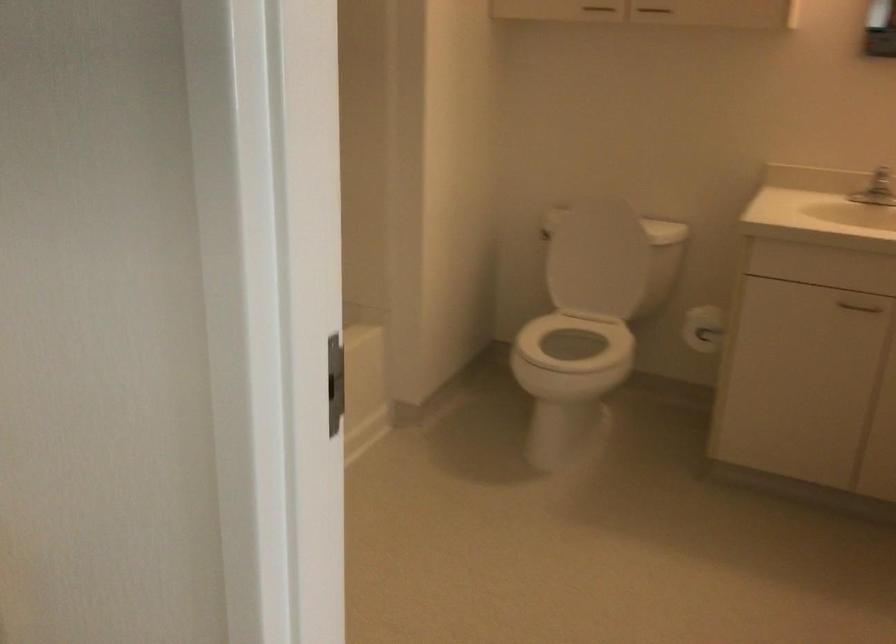
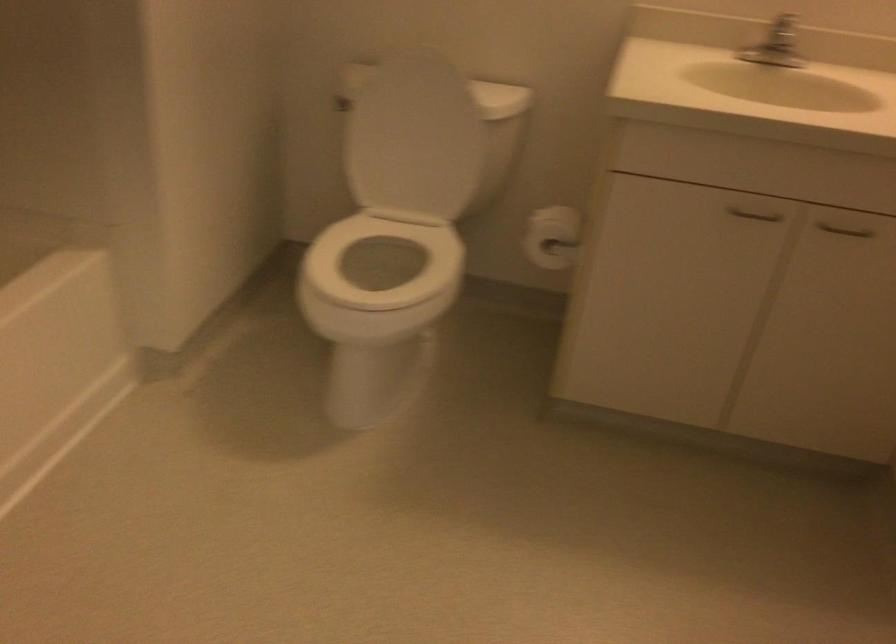
Question: The camera is either moving clockwise (left) or counter-clockwise (right) around the object. The first image is from the beginning of the video and the second image is from the end. Is the camera moving left or right when shooting the video?

Choices:
 (A) Left
 (B) Right

Answer: (A)